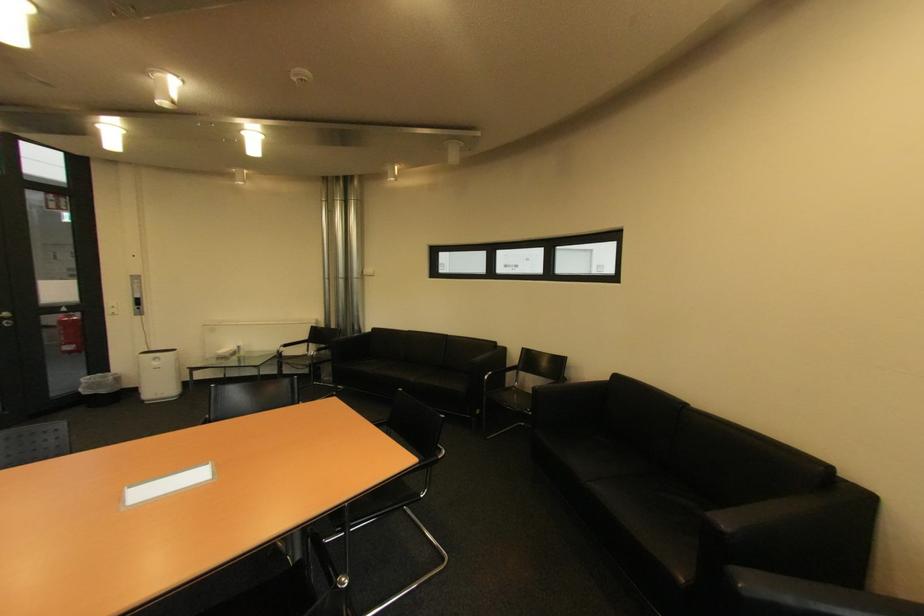
You are a GUI agent. You are given a task and a screenshot of the screen. Output one action in this format:
    pyautogui.click(x=<x>, y=<y>)
    Task: Click on the wall button panel
    This screenshot has height=616, width=924.
    Given the screenshot: What is the action you would take?
    pyautogui.click(x=137, y=294)